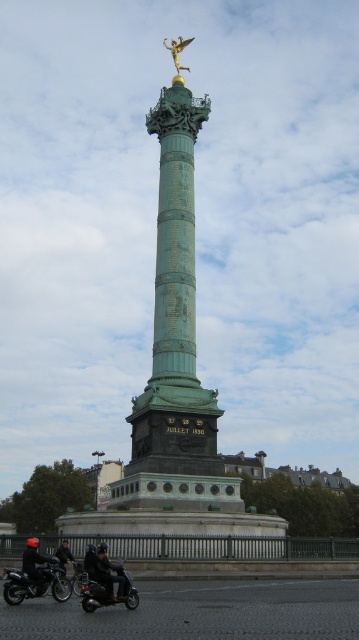
Question: Among these points, which one is nearest to the camera?

Choices:
 (A) (176, 65)
 (B) (3, 582)
 (C) (26, 556)

Answer: (C)

Question: Which of the following is the farthest from the observer?

Choices:
 (A) (26, 540)
 (B) (92, 573)

Answer: (A)

Question: Does green patina column at center have a greater width compared to gold metallic angel at upper center?

Choices:
 (A) yes
 (B) no

Answer: (A)

Question: From the image, what is the correct spatial relationship of shiny black scooter at lower left in relation to black leather jacket at lower left?

Choices:
 (A) right
 (B) left

Answer: (A)

Question: Which object is closer to the camera taking this photo?

Choices:
 (A) shiny black scooter at lower left
 (B) black leather jacket at lower left
 (C) green patina column at center
 (D) dark gray leather jacket at lower center

Answer: (A)

Question: Does shiny black motorcycle at lower left appear over dark gray leather jacket at lower left?

Choices:
 (A) yes
 (B) no

Answer: (B)